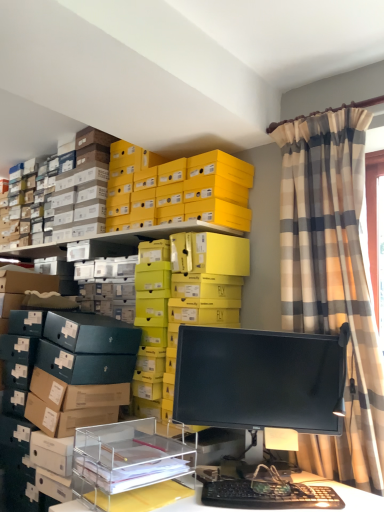
Locate an element on the screen. The image size is (384, 512). free space above black plastic keyboard at lower center (from a real-world perspective) is located at coordinates (264, 486).